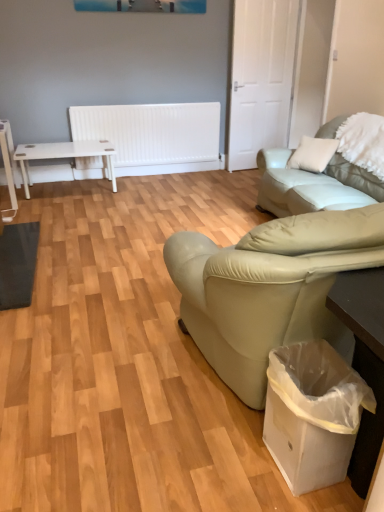
Question: From the image's perspective, does white fluffy pillow at upper right appear lower than white plastic bag at lower right?

Choices:
 (A) no
 (B) yes

Answer: (A)

Question: From the image's perspective, is white fluffy pillow at upper right located above white plastic bag at lower right?

Choices:
 (A) yes
 (B) no

Answer: (A)

Question: From a real-world perspective, is white fluffy pillow at upper right below white plastic bag at lower right?

Choices:
 (A) yes
 (B) no

Answer: (B)

Question: Is the position of white fluffy pillow at upper right less distant than that of white plastic bag at lower right?

Choices:
 (A) yes
 (B) no

Answer: (B)

Question: Does white fluffy pillow at upper right have a greater height compared to white plastic bag at lower right?

Choices:
 (A) yes
 (B) no

Answer: (B)

Question: From the image's perspective, relative to leather couch at right, is white plastic table at lower right, marked as the 2th table in a back-to-front arrangement, above or below?

Choices:
 (A) below
 (B) above

Answer: (A)

Question: Does point (375, 384) appear closer or farther from the camera than point (268, 186)?

Choices:
 (A) closer
 (B) farther

Answer: (A)

Question: Is white plastic table at lower right, arranged as the 1th table when viewed from the right, taller or shorter than leather couch at right?

Choices:
 (A) short
 (B) tall

Answer: (A)

Question: Is white plastic table at lower right, which appears as the 2th table when viewed from the left, in front of or behind leather couch at right in the image?

Choices:
 (A) behind
 (B) front

Answer: (B)

Question: From their relative heights in the image, would you say white plastic bag at lower right is taller or shorter than white plastic table at lower right, which appears as the 2th table when viewed from the left?

Choices:
 (A) tall
 (B) short

Answer: (B)

Question: From the image's perspective, is white plastic bag at lower right positioned above or below white plastic table at lower right, which is the 1th table from bottom to top?

Choices:
 (A) above
 (B) below

Answer: (B)

Question: Considering the positions of point (281, 434) and point (377, 446), is point (281, 434) closer or farther from the camera than point (377, 446)?

Choices:
 (A) farther
 (B) closer

Answer: (A)

Question: Considering their positions, is white plastic bag at lower right located in front of or behind white plastic table at lower right, placed as the first table when sorted from front to back?

Choices:
 (A) front
 (B) behind

Answer: (B)

Question: Is white fluffy pillow at upper right in front of or behind leather couch at right in the image?

Choices:
 (A) front
 (B) behind

Answer: (B)

Question: Is white fluffy pillow at upper right inside the boundaries of leather couch at right, or outside?

Choices:
 (A) inside
 (B) outside

Answer: (A)